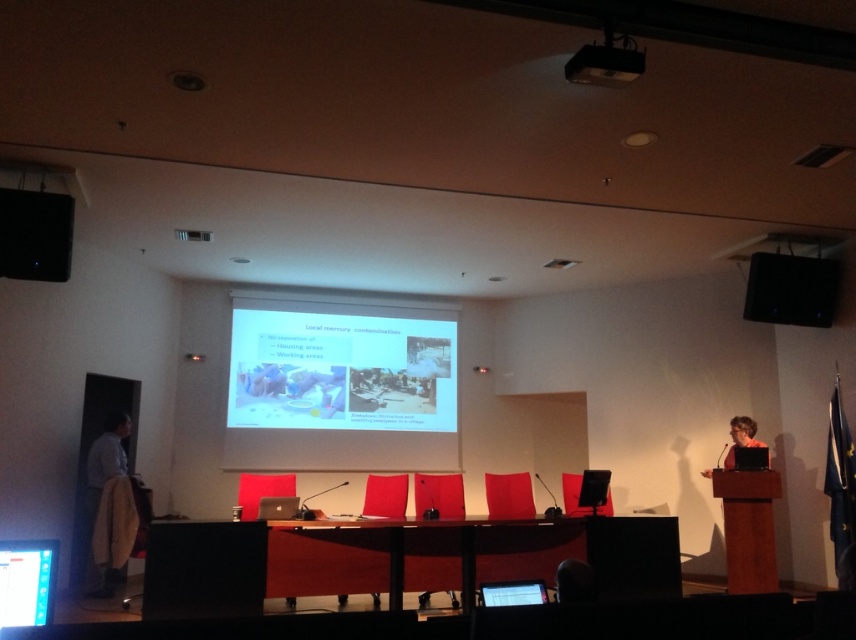
Can you confirm if black plastic speaker at upper right is taller than matte black laptop at right?

Yes, black plastic speaker at upper right is taller than matte black laptop at right.

Does black plastic speaker at upper right lie behind matte black laptop at right?

Yes, it is.

This screenshot has height=640, width=856. In order to click on black plastic speaker at upper right in this screenshot , I will do `click(792, 289)`.

Where is `black plastic projector at upper center`? black plastic projector at upper center is located at coordinates (605, 64).

Is black plastic projector at upper center positioned behind matte black laptop at right?

No.

Where is `black plastic projector at upper center`? This screenshot has width=856, height=640. black plastic projector at upper center is located at coordinates (605, 64).

Is matte black screen at lower left positioned before black plastic projector at upper center?

That is True.

Is point (36, 566) closer to camera compared to point (642, 65)?

Yes, point (36, 566) is in front of point (642, 65).

This screenshot has height=640, width=856. Find the location of `matte black screen at lower left`. matte black screen at lower left is located at coordinates (27, 580).

Image resolution: width=856 pixels, height=640 pixels. I want to click on matte black screen at lower left, so click(x=27, y=580).